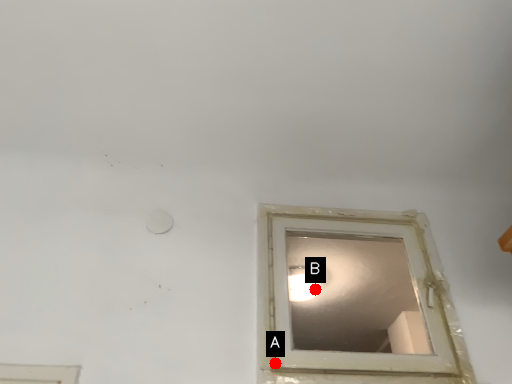
Question: Two points are circled on the image, labeled by A and B beside each circle. Which point is farther from the camera taking this photo?

Choices:
 (A) A is further
 (B) B is further

Answer: (B)